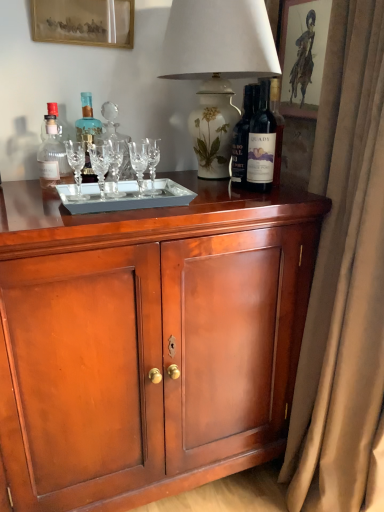
Question: From the image's perspective, is white floral vase at upper center below gold-framed picture at upper left, which appears as the second picture frame when viewed from the right?

Choices:
 (A) yes
 (B) no

Answer: (A)

Question: From a real-world perspective, is white floral vase at upper center located beneath gold-framed picture at upper left, marked as the first picture frame in a left-to-right arrangement?

Choices:
 (A) no
 (B) yes

Answer: (B)

Question: Is white floral vase at upper center at the left side of gold-framed picture at upper left, marked as the first picture frame in a left-to-right arrangement?

Choices:
 (A) no
 (B) yes

Answer: (A)

Question: Is white floral vase at upper center shorter than gold-framed picture at upper left, which appears as the second picture frame when viewed from the right?

Choices:
 (A) yes
 (B) no

Answer: (B)

Question: Is white floral vase at upper center taller than gold-framed picture at upper left, which appears as the second picture frame when viewed from the right?

Choices:
 (A) no
 (B) yes

Answer: (B)

Question: From a real-world perspective, is beige velvet curtain at right physically located above or below blue glass bottle at center, which is the 2th bottle from right to left?

Choices:
 (A) below
 (B) above

Answer: (A)

Question: In the image, is beige velvet curtain at right positioned in front of or behind blue glass bottle at center, positioned as the second bottle in left-to-right order?

Choices:
 (A) front
 (B) behind

Answer: (A)

Question: Which is correct: beige velvet curtain at right is inside blue glass bottle at center, positioned as the second bottle in left-to-right order, or outside of it?

Choices:
 (A) inside
 (B) outside

Answer: (B)

Question: Would you say beige velvet curtain at right is to the left or to the right of blue glass bottle at center, positioned as the second bottle in left-to-right order, in the picture?

Choices:
 (A) left
 (B) right

Answer: (B)

Question: From the image's perspective, is white floral vase at upper center located above or below blue glass bottle at center, which is the 2th bottle from right to left?

Choices:
 (A) above
 (B) below

Answer: (A)

Question: Considering the positions of point (226, 41) and point (84, 105), is point (226, 41) closer or farther from the camera than point (84, 105)?

Choices:
 (A) closer
 (B) farther

Answer: (A)

Question: From their relative heights in the image, would you say white floral vase at upper center is taller or shorter than blue glass bottle at center, which is the 2th bottle from right to left?

Choices:
 (A) tall
 (B) short

Answer: (A)

Question: In the image, is white floral vase at upper center positioned in front of or behind blue glass bottle at center, which is the 2th bottle from right to left?

Choices:
 (A) behind
 (B) front

Answer: (B)

Question: From the image's perspective, is matte glass bottle at left, the first bottle from the left, located above or below blue glass bottle at center, positioned as the second bottle in left-to-right order?

Choices:
 (A) above
 (B) below

Answer: (B)

Question: Considering the positions of matte glass bottle at left, the first bottle from the left, and blue glass bottle at center, which is the 2th bottle from right to left, in the image, is matte glass bottle at left, the first bottle from the left, wider or thinner than blue glass bottle at center, which is the 2th bottle from right to left,?

Choices:
 (A) wide
 (B) thin

Answer: (A)